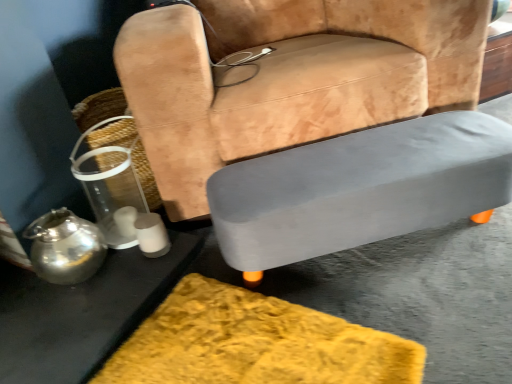
Find the location of a particular element. Image resolution: width=512 pixels, height=384 pixels. free spot below shiny metallic teapot at lower left (from a real-world perspective) is located at coordinates (78, 282).